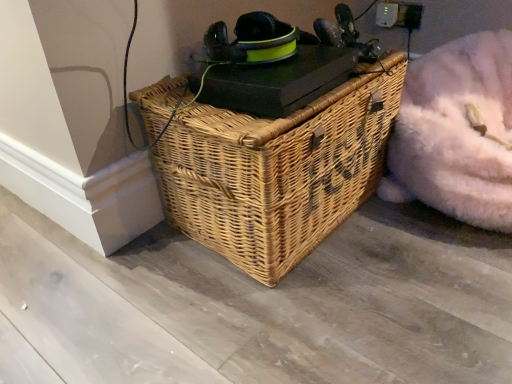
This screenshot has height=384, width=512. I want to click on free space in front of natural wicker picnic basket at center, so click(x=308, y=318).